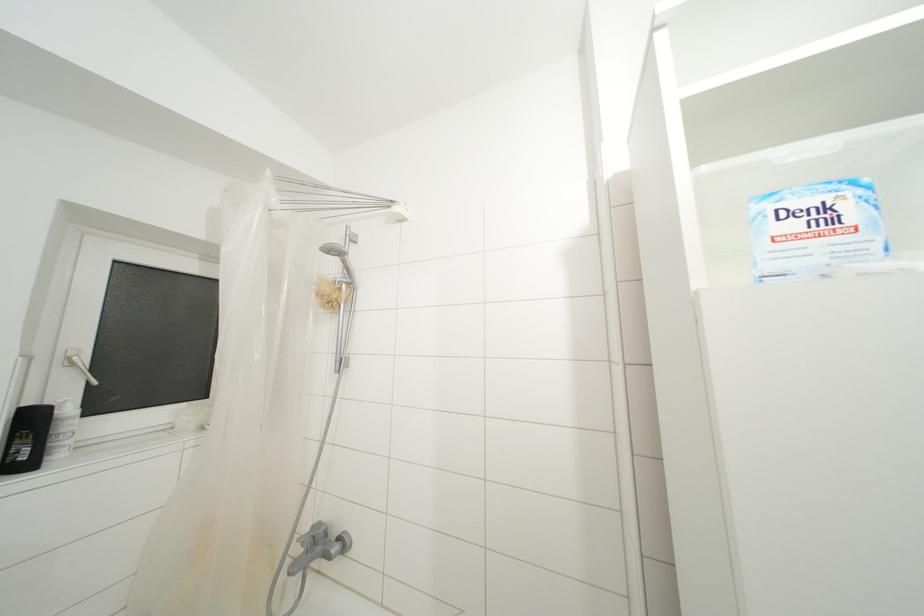
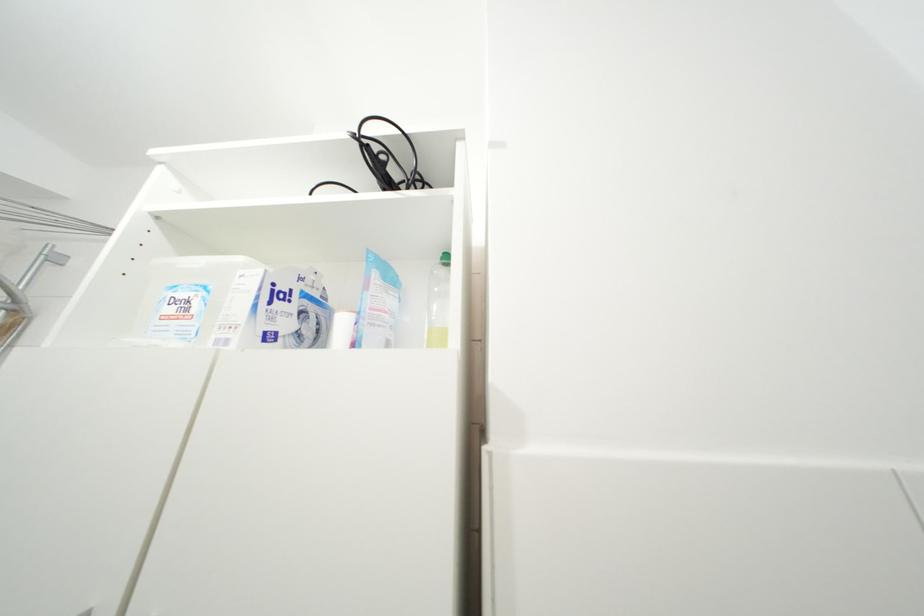
The images are taken continuously from a first-person perspective. In which direction are you moving?

The movement direction of the cameraman is right, backward.